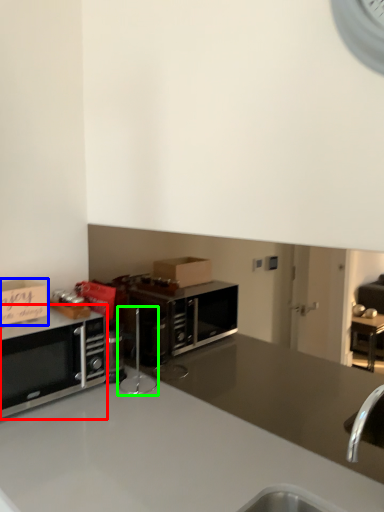
Question: Which object is the closest to the microwave oven (highlighted by a red box)? Choose among these: cabinetry (highlighted by a blue box) or appliance (highlighted by a green box).

Choices:
 (A) cabinetry
 (B) appliance

Answer: (A)